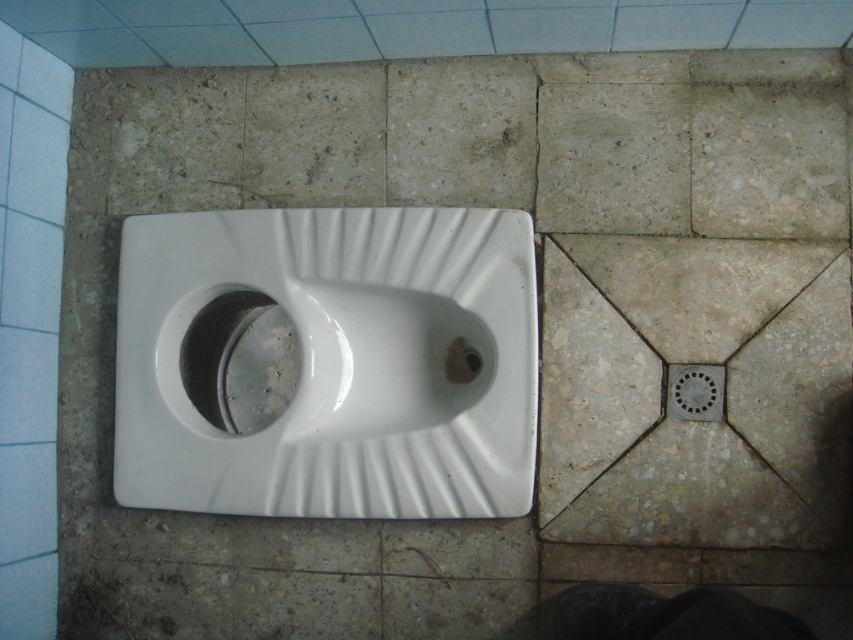
Question: In this image, where is white glossy urinal at center located relative to matte metallic drain at lower right?

Choices:
 (A) right
 (B) left

Answer: (B)

Question: Is the position of white glossy urinal at center more distant than that of black rubber drain at center?

Choices:
 (A) yes
 (B) no

Answer: (B)

Question: Which is farther from the black rubber drain at center?

Choices:
 (A) white glossy urinal at center
 (B) matte metallic drain at lower right

Answer: (B)

Question: Which point is farther to the camera?

Choices:
 (A) (453, 342)
 (B) (253, 508)
 (C) (706, 381)

Answer: (A)

Question: Can you confirm if white glossy urinal at center is bigger than matte metallic drain at lower right?

Choices:
 (A) no
 (B) yes

Answer: (B)

Question: Considering the real-world distances, which object is closest to the white glossy urinal at center?

Choices:
 (A) black rubber drain at center
 (B) matte metallic drain at lower right

Answer: (A)